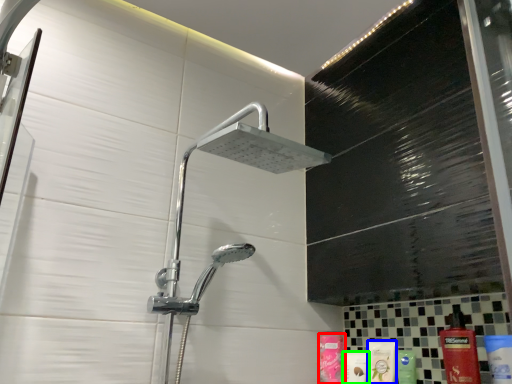
Question: Which object is the farthest from toiletry (highlighted by a red box)? Choose among these: mouthwash (highlighted by a blue box) or toiletry (highlighted by a green box).

Choices:
 (A) mouthwash
 (B) toiletry

Answer: (A)